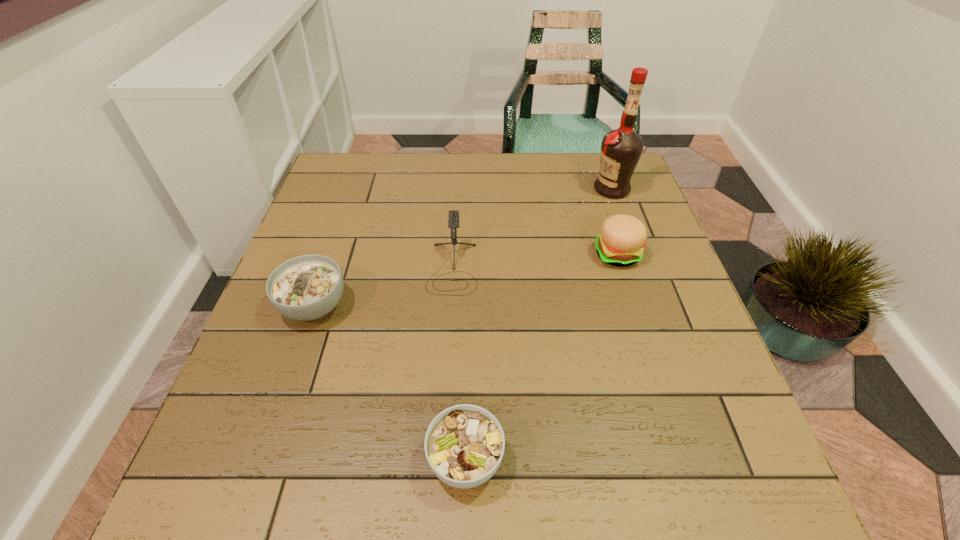
Image resolution: width=960 pixels, height=540 pixels. I want to click on free spot between the liquor and the microphone, so click(532, 228).

Where is `free spot between the leftmost object and the right soup bowl`? The height and width of the screenshot is (540, 960). free spot between the leftmost object and the right soup bowl is located at coordinates (390, 382).

Where is `empty space that is in between the microphone and the hamburger`? empty space that is in between the microphone and the hamburger is located at coordinates (535, 261).

Identify the location of vacant space that's between the microphone and the liquor. (532, 228).

At what (x,y) coordinates should I click in order to perform the action: click on empty space that is in between the hamburger and the right soup bowl. Please return your answer as a coordinate pair (x, y). This screenshot has height=540, width=960. Looking at the image, I should click on (541, 357).

Locate an element on the screen. The image size is (960, 540). vacant area that lies between the hamburger and the microphone is located at coordinates (535, 261).

Where is `empty space between the farther soup bowl and the hamburger`? The height and width of the screenshot is (540, 960). empty space between the farther soup bowl and the hamburger is located at coordinates (466, 280).

You are a GUI agent. You are given a task and a screenshot of the screen. Output one action in this format:
    pyautogui.click(x=<x>, y=<y>)
    Task: Click on the object that is the second closest to the hamburger
    The height and width of the screenshot is (540, 960).
    Given the screenshot: What is the action you would take?
    pyautogui.click(x=453, y=220)

Image resolution: width=960 pixels, height=540 pixels. Find the location of `object that is the closest to the liquor`. object that is the closest to the liquor is located at coordinates (620, 243).

At what (x,y) coordinates should I click in order to perform the action: click on free location that satisfies the following two spatial constraints: 1. on the stand of the microphone; 2. on the left side of the right soup bowl. Please return your answer as a coordinate pair (x, y). Looking at the image, I should click on (441, 460).